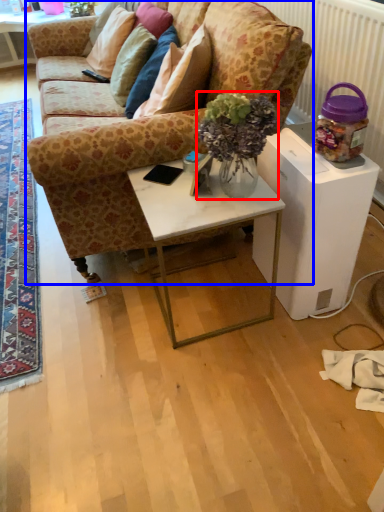
Question: Which point is further to the camera, houseplant (highlighted by a red box) or studio couch (highlighted by a blue box)?

Choices:
 (A) houseplant
 (B) studio couch

Answer: (B)